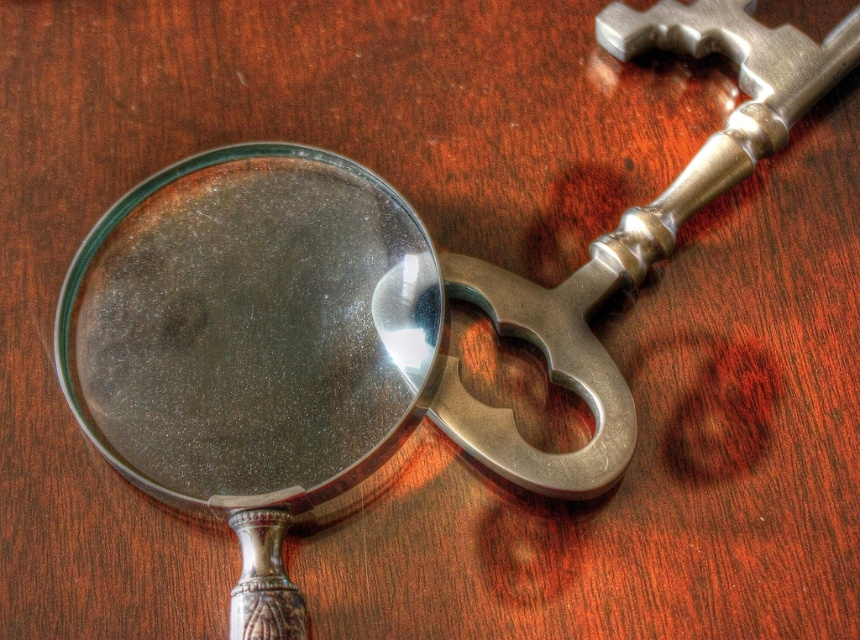
Question: Which point is closer to the camera?

Choices:
 (A) matte silver magnifying glass at center
 (B) polished metal key at upper right

Answer: (A)

Question: Is matte silver magnifying glass at center to the left of polished metal key at upper right from the viewer's perspective?

Choices:
 (A) yes
 (B) no

Answer: (A)

Question: Which object is closer to the camera taking this photo?

Choices:
 (A) matte silver magnifying glass at center
 (B) polished metal key at upper right

Answer: (A)

Question: Which object is farther from the camera taking this photo?

Choices:
 (A) matte silver magnifying glass at center
 (B) polished metal key at upper right

Answer: (B)

Question: Is matte silver magnifying glass at center thinner than polished metal key at upper right?

Choices:
 (A) yes
 (B) no

Answer: (A)

Question: Is the position of matte silver magnifying glass at center more distant than that of polished metal key at upper right?

Choices:
 (A) yes
 (B) no

Answer: (B)